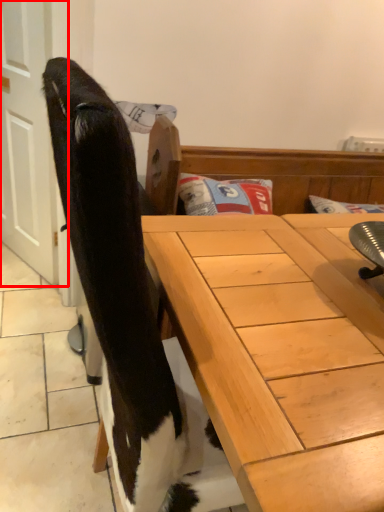
Question: Observing the image, what is the correct spatial positioning of screen door (annotated by the red box) in reference to desk?

Choices:
 (A) right
 (B) left

Answer: (B)